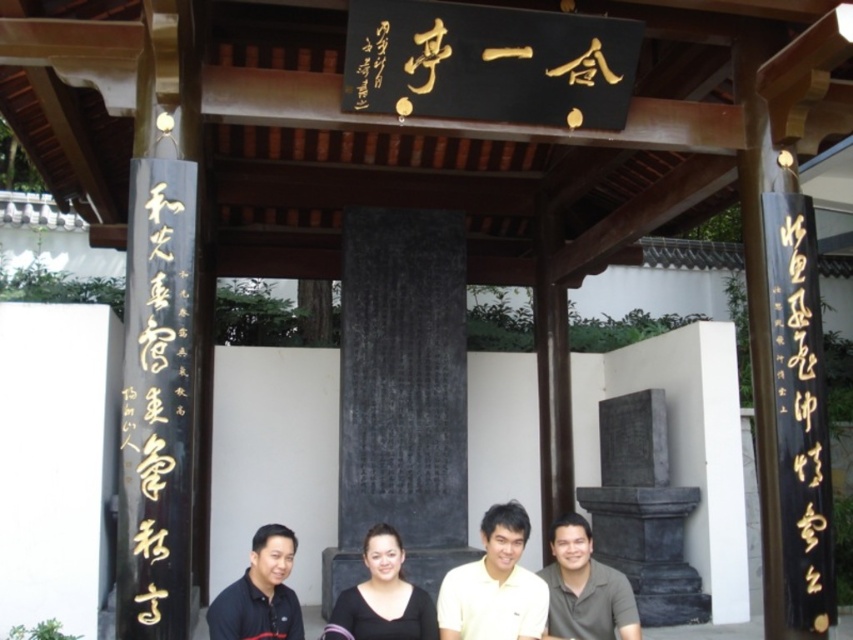
Who is more forward, (144, 307) or (579, 520)?

Point (144, 307) is more forward.

Who is more distant from viewer, (x=131, y=262) or (x=569, y=573)?

The point (x=569, y=573) is more distant.

The width and height of the screenshot is (853, 640). What are the coordinates of `black calligraphy at left` in the screenshot? It's located at (158, 397).

Which of these two, black shirt at center or black matte dress at center, stands shorter?

Standing shorter between the two is black matte dress at center.

What do you see at coordinates (451, 589) in the screenshot?
I see `black shirt at center` at bounding box center [451, 589].

Where is `black shirt at center`? This screenshot has height=640, width=853. black shirt at center is located at coordinates (451, 589).

Is point (184, 272) positioned in front of point (358, 630)?

That is False.

Between black calligraphy at left and black matte dress at center, which one has less height?

Standing shorter between the two is black matte dress at center.

Is point (183, 580) behind point (398, 627)?

No.

The image size is (853, 640). What are the coordinates of `black calligraphy at left` in the screenshot? It's located at (158, 397).